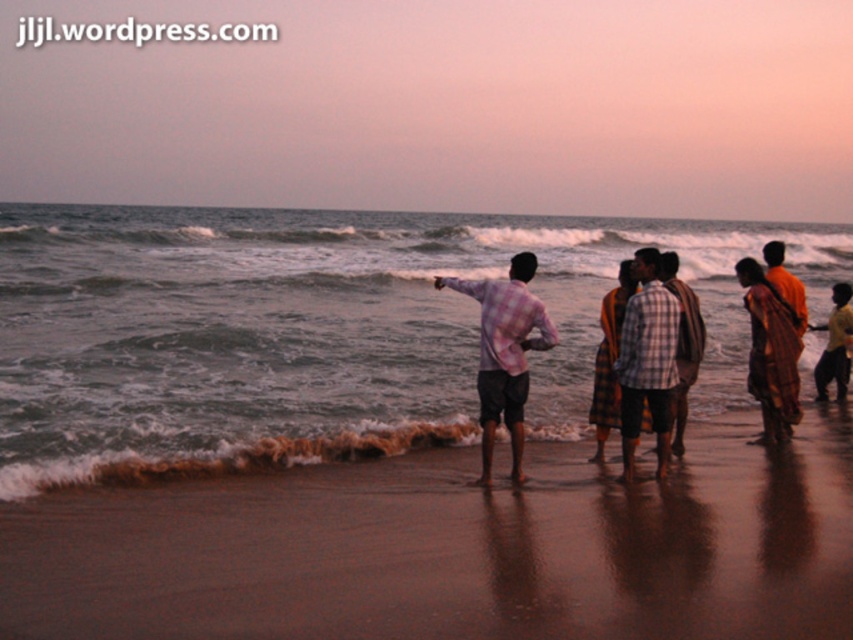
You are a photographer aiming to capture the brown sand at lower center and the pink checkered shirt at center in the same frame. Based on their positions, will the sand appear above or below the shirt in the photo?

The brown sand at lower center is located below the pink checkered shirt at center, so in the photo, the sand will appear below the shirt.

You are standing on the beach in the image and want to reach the point marked as point (799, 556). If you start walking straight ahead from your current position, will you reach that point without changing direction?

The point (799, 556) is 7.66 meters from the camera, so if you walk straight ahead from your current position, you will reach that point without needing to change direction.